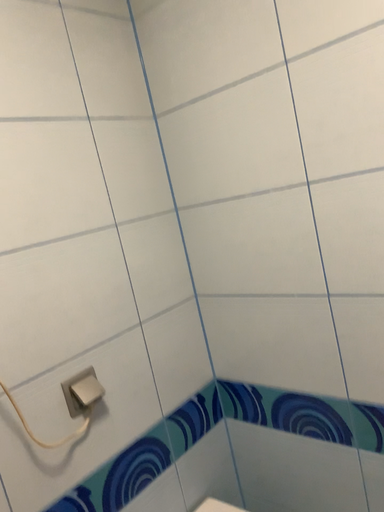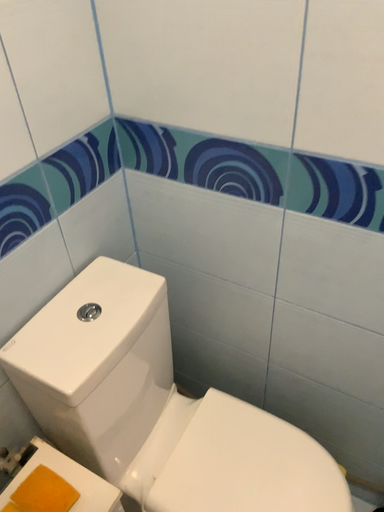
Question: Which way did the camera rotate in the video?

Choices:
 (A) rotated upward
 (B) rotated downward

Answer: (B)